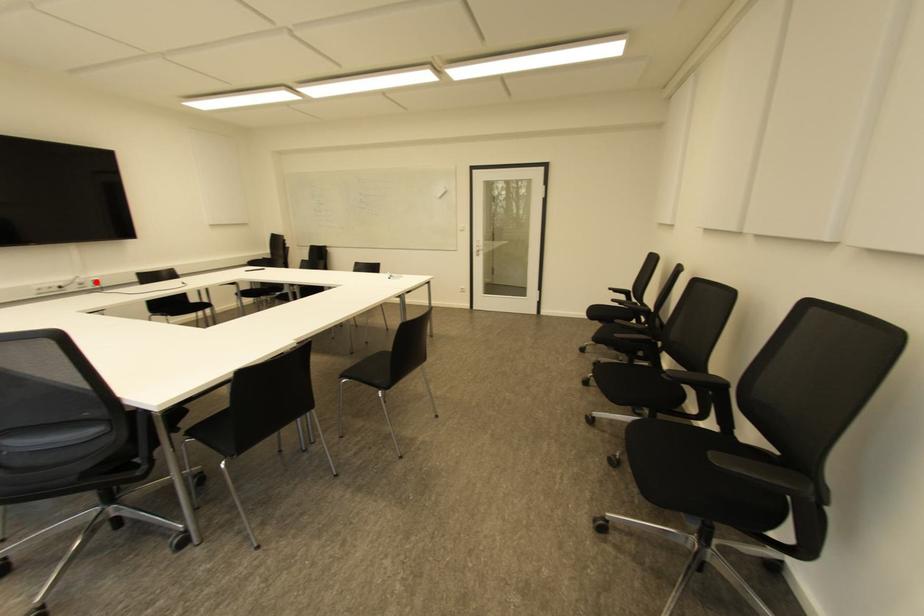
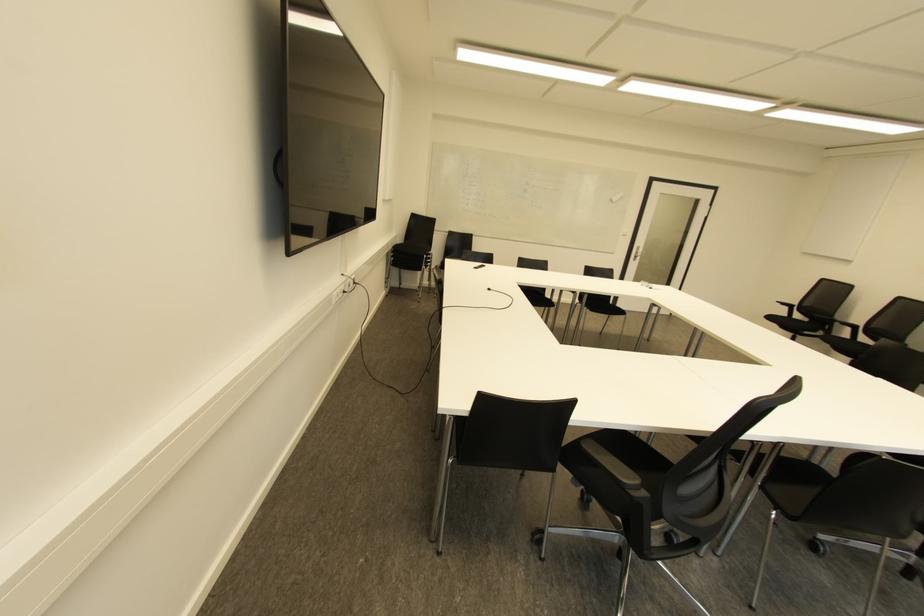
Locate, in the second image, the point that corresponds to the highlighted location in the first image.

(354, 282)